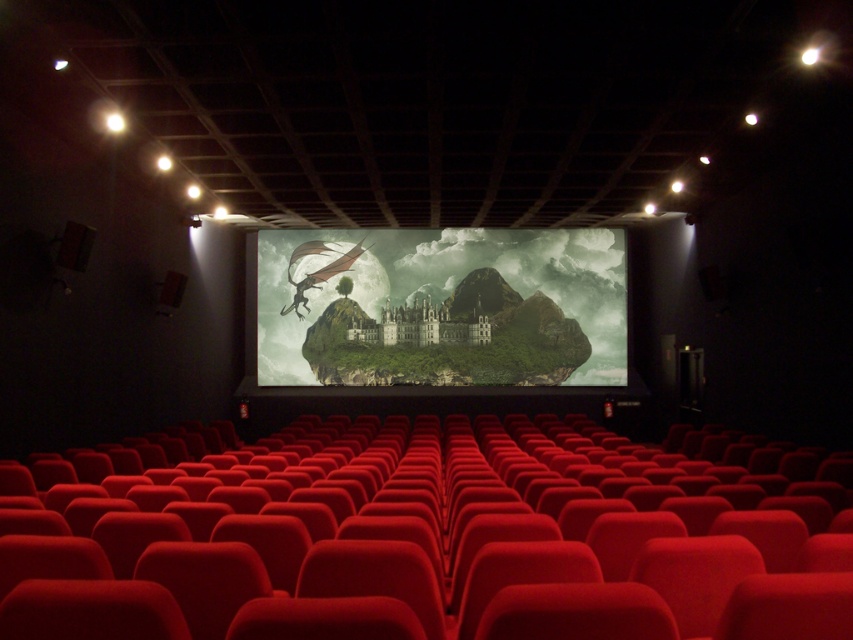
Does velvet red seat at center appear on the right side of green matte island at center?

No, velvet red seat at center is not to the right of green matte island at center.

Can you confirm if velvet red seat at center is wider than green matte island at center?

Incorrect, velvet red seat at center's width does not surpass green matte island at center's.

Is point (799, 630) closer to viewer compared to point (601, 259)?

Yes.

The height and width of the screenshot is (640, 853). In order to click on velvet red seat at center in this screenshot , I will do `click(428, 541)`.